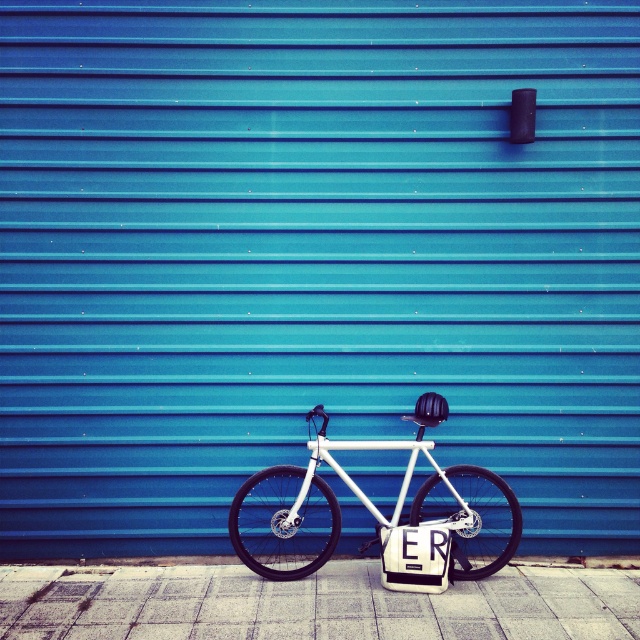
Question: Which point is closer to the camera?

Choices:
 (A) white matte bicycle at center
 (B) gray concrete pavement at lower center

Answer: (B)

Question: Can you confirm if gray concrete pavement at lower center is thinner than white matte bicycle at center?

Choices:
 (A) yes
 (B) no

Answer: (B)

Question: Among these objects, which one is nearest to the camera?

Choices:
 (A) gray concrete pavement at lower center
 (B) white matte bicycle at center

Answer: (A)

Question: Does gray concrete pavement at lower center appear on the right side of white matte bicycle at center?

Choices:
 (A) yes
 (B) no

Answer: (B)

Question: Which point appears farthest from the camera in this image?

Choices:
 (A) tap(29, 572)
 (B) tap(273, 544)

Answer: (B)

Question: Is gray concrete pavement at lower center bigger than white matte bicycle at center?

Choices:
 (A) yes
 (B) no

Answer: (B)